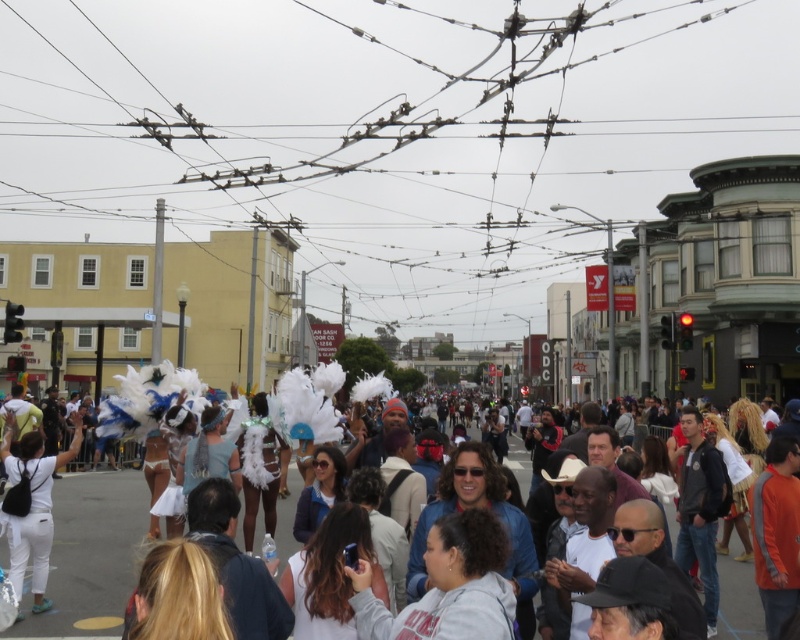
Question: Which point is closer to the camera?

Choices:
 (A) 5,435
 (B) 516,241

Answer: (A)

Question: Is white feathered costumes at center closer to the viewer compared to white matte backpack at lower left?

Choices:
 (A) no
 (B) yes

Answer: (A)

Question: Is white feathered costumes at center bigger than white matte backpack at lower left?

Choices:
 (A) yes
 (B) no

Answer: (B)

Question: Which of the following is the closest to the observer?

Choices:
 (A) white matte backpack at lower left
 (B) metallic wires at center
 (C) white feathered costumes at center

Answer: (A)

Question: Which object is positioned closest to the white feathered costumes at center?

Choices:
 (A) metallic wires at center
 (B) white matte backpack at lower left

Answer: (B)

Question: Does metallic wires at center come in front of white matte backpack at lower left?

Choices:
 (A) no
 (B) yes

Answer: (A)